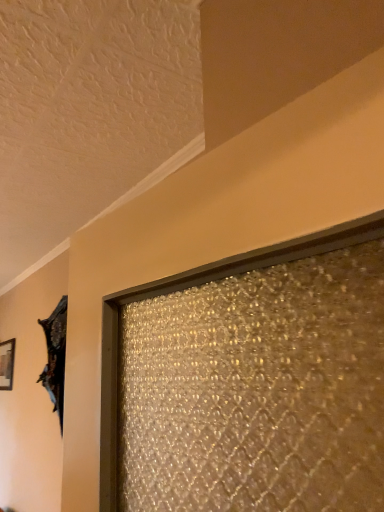
Describe the element at coordinates (7, 364) in the screenshot. I see `wooden picture frame at left` at that location.

Locate an element on the screen. This screenshot has width=384, height=512. wooden picture frame at left is located at coordinates (7, 364).

What are the coordinates of `wooden picture frame at left` in the screenshot? It's located at (7, 364).